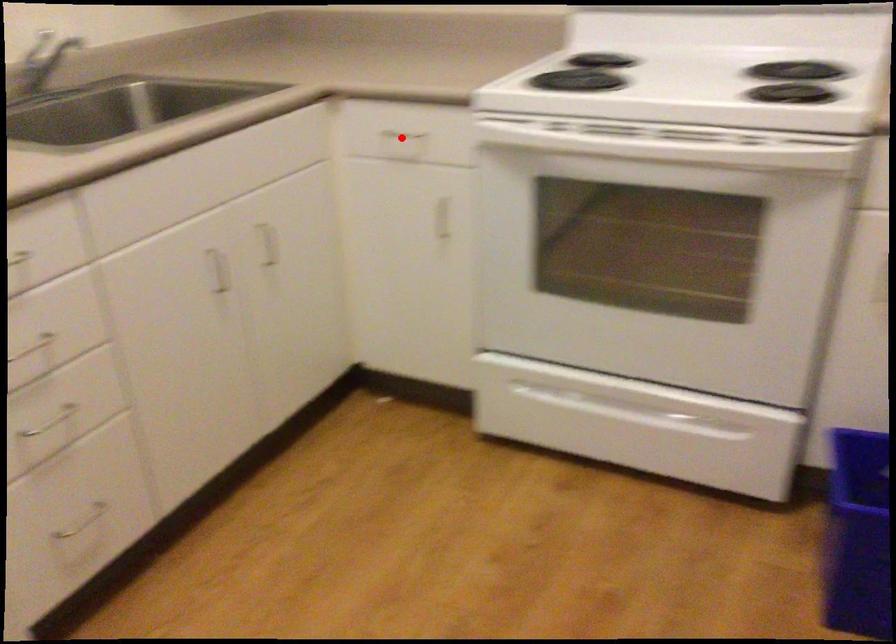
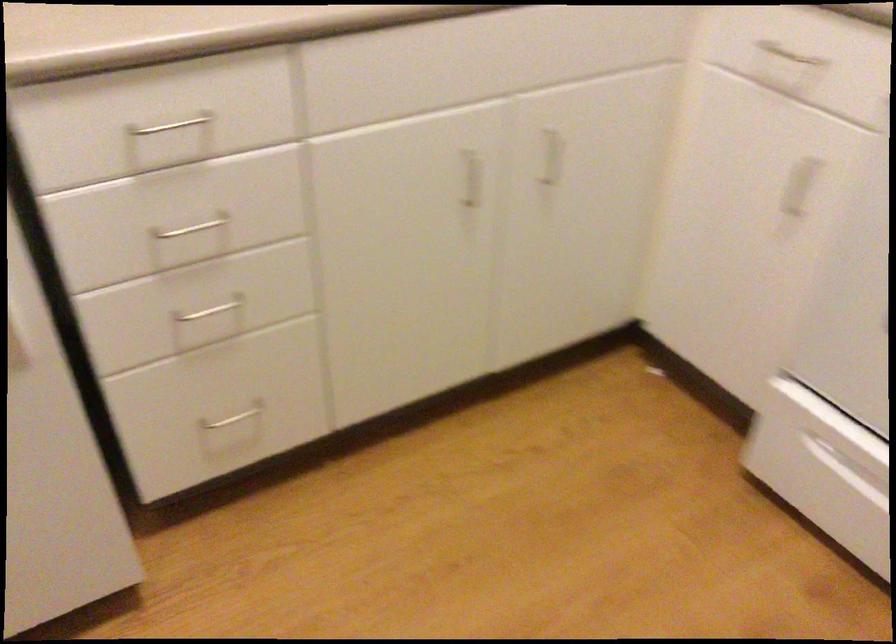
The point at the highlighted location is marked in the first image. Where is the corresponding point in the second image?

(789, 55)